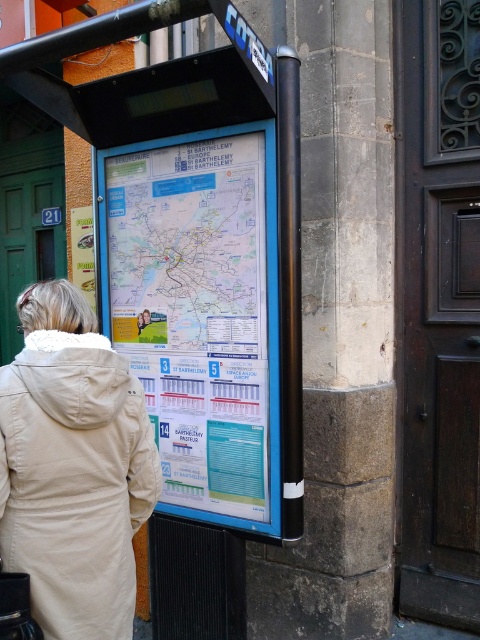
You are a traveler looking at the public transportation information board. You see the white paper map at center and the beige fleece coat at lower left. Which object is positioned higher on the board?

The white paper map at center is located above the beige fleece coat at lower left, so the white paper map at center is positioned higher on the board.

You are standing in front of a public transportation information board. You need to locate the blue plastic signboard at center. According to the coordinates provided, where exactly is it positioned?

The blue plastic signboard at center is located at point (165, 312).